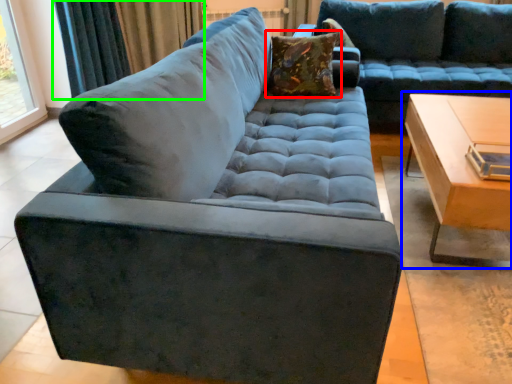
Question: Which object is the closest to the pillow (highlighted by a red box)? Choose among these: table (highlighted by a blue box) or curtain (highlighted by a green box).

Choices:
 (A) table
 (B) curtain

Answer: (A)